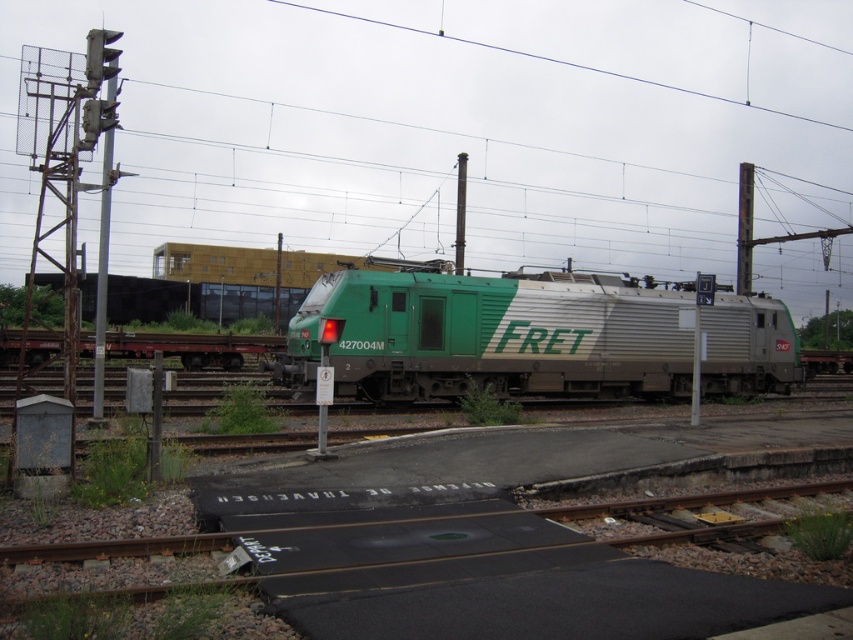
Is green metallic freight locomotive at center smaller than metallic wire at upper center?

Yes.

Is point (418, 381) closer to viewer compared to point (495, 49)?

That is True.

Which is in front, point (376, 332) or point (821, 125)?

Point (376, 332) is in front.

This screenshot has height=640, width=853. Find the location of `green metallic freight locomotive at center`. green metallic freight locomotive at center is located at coordinates (488, 336).

Which is more to the right, metallic signal light at left or metallic gray pole at upper right?

metallic gray pole at upper right

Where is `metallic signal light at left`? The width and height of the screenshot is (853, 640). metallic signal light at left is located at coordinates (102, 276).

Locate an element on the screen. The image size is (853, 640). metallic signal light at left is located at coordinates (102, 276).

Can you confirm if metallic signal light at left is positioned below green metallic pole at center?

Correct, metallic signal light at left is located below green metallic pole at center.

Measure the distance between metallic signal light at left and camera.

metallic signal light at left is 13.20 meters from camera.

Does point (109, 134) come in front of point (279, 291)?

Yes.

Find the location of a particular element. This screenshot has width=853, height=640. metallic signal light at left is located at coordinates (102, 276).